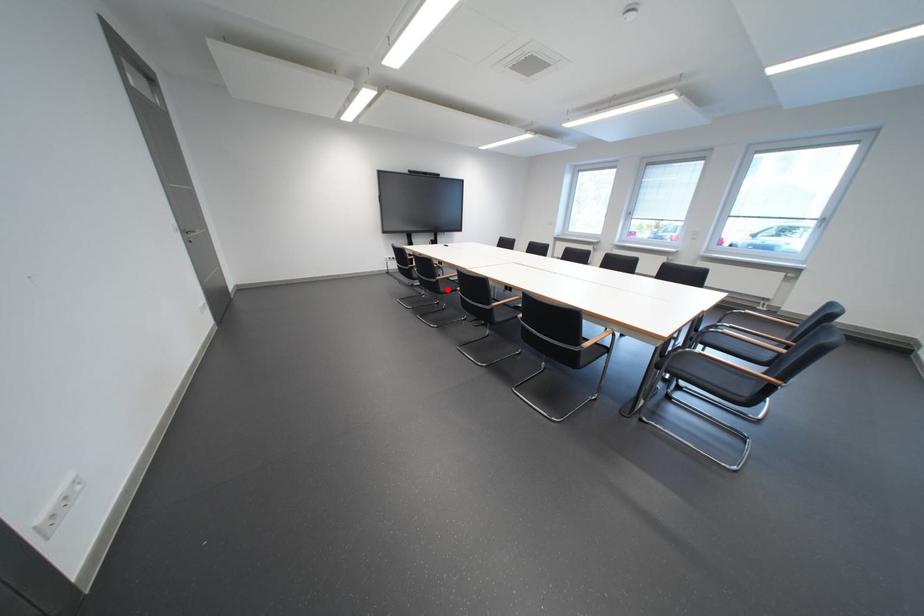
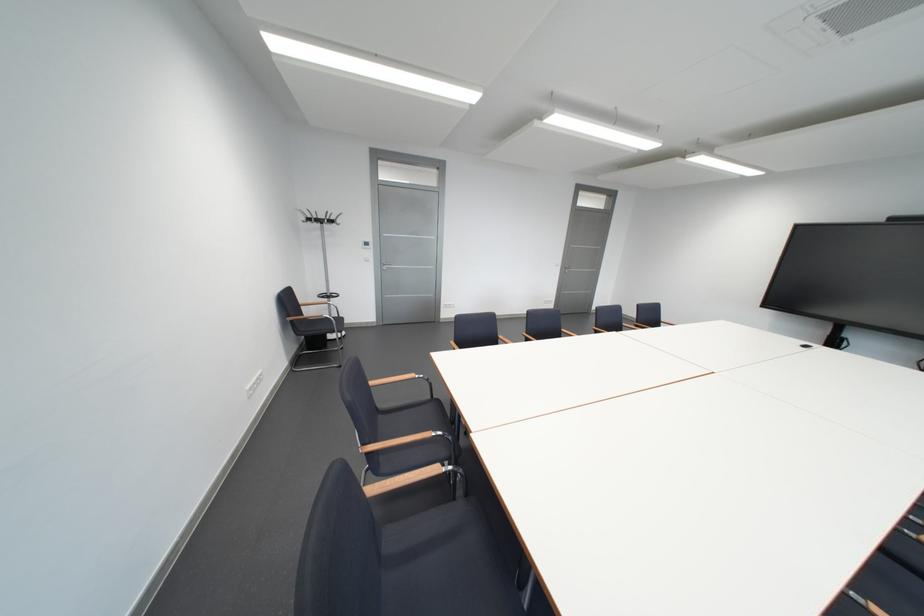
Question: I am providing you with two images of the same scene from different viewpoints. A red point is marked on the first image. Is the red point's position out of view in image 2?

Choices:
 (A) Yes
 (B) No

Answer: (A)